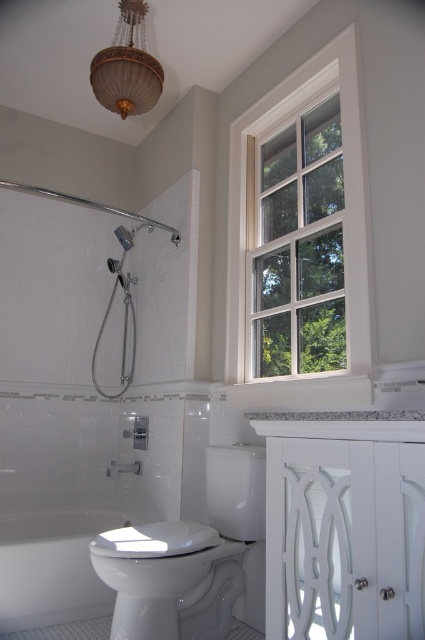
From the picture: You are an interior designer assessing the bathroom layout. You need to determine if the white wood window at upper right can accommodate a new decorative element that requires more space than the gold textured lampshade at upper center. Based on their widths, can the window support this element?

The white wood window at upper right has a greater width than the gold textured lampshade at upper center, so it can accommodate the decorative element requiring more space.

You are standing in the bathroom and want to locate the gold textured lampshade at upper center. According to the coordinates provided, where would you find the point (127, 65)?

The point (127, 65) is located on the gold textured lampshade at upper center.

You are standing in the bathroom and want to open the white wood window at upper right to let in more light. Based on its position, where should you look to find it?

The white wood window at upper right is located at point (345, 196), so you should look towards the upper right area of the bathroom to find it.